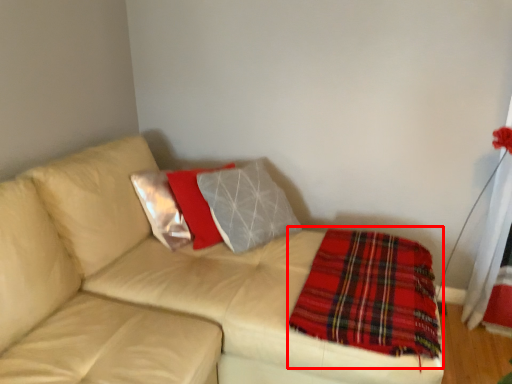
Question: From the image's perspective, considering the relative positions of blanket (annotated by the red box) and studio couch in the image provided, where is blanket (annotated by the red box) located with respect to the staircase?

Choices:
 (A) below
 (B) above

Answer: (A)